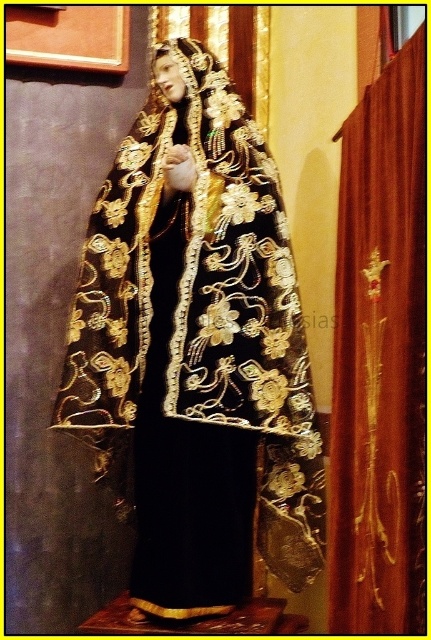
Is point (197, 460) closer to viewer compared to point (355, 248)?

No, (197, 460) is behind (355, 248).

Consider the image. Between black velvet cape at center and burgundy velvet curtain at right, which one has more height?

With more height is black velvet cape at center.

Between point (212, 332) and point (397, 106), which one is positioned behind?

Point (212, 332)

Where is `black velvet cape at center`? This screenshot has width=431, height=640. black velvet cape at center is located at coordinates (197, 348).